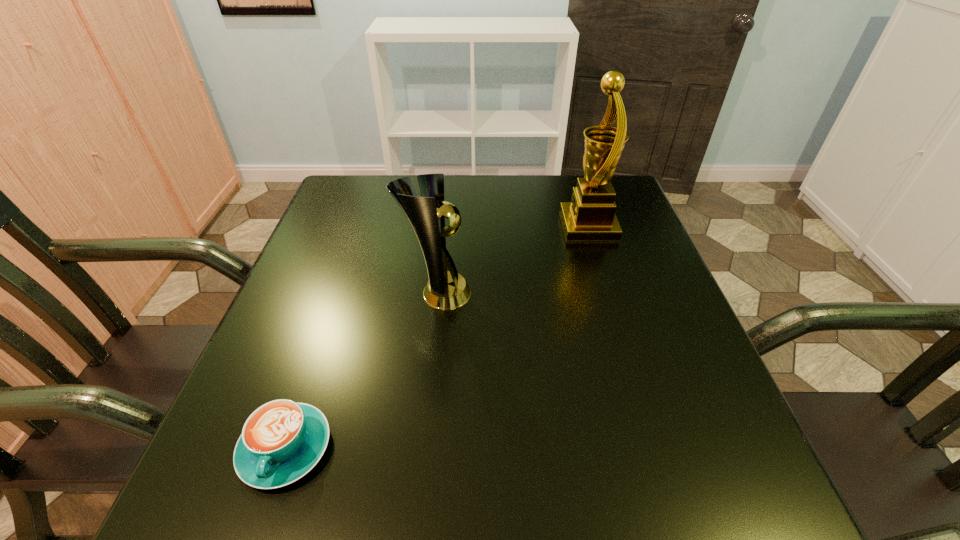
Identify the location of vacant region between the leftmost object and the taller award. (437, 337).

Locate an element on the screen. vacant point located between the tallest object and the cappuccino is located at coordinates (437, 337).

This screenshot has height=540, width=960. Find the location of `object that stands as the closest to the left award`. object that stands as the closest to the left award is located at coordinates [x=281, y=441].

Point out which object is positioned as the second nearest to the leftmost object. Please provide its 2D coordinates. Your answer should be formatted as a tuple, i.e. [(x, y)], where the tuple contains the x and y coordinates of a point satisfying the conditions above.

[(590, 216)]

Where is `free space that satisfies the following two spatial constraints: 1. on the front-facing side of the rightmost object; 2. with the handle on the right side of the nearest object`? The image size is (960, 540). free space that satisfies the following two spatial constraints: 1. on the front-facing side of the rightmost object; 2. with the handle on the right side of the nearest object is located at coordinates (658, 448).

The image size is (960, 540). Identify the location of blank space that satisfies the following two spatial constraints: 1. on the front-facing side of the taller award; 2. with the handle on the right side of the nearest object. coord(658,448).

This screenshot has width=960, height=540. I want to click on vacant region that satisfies the following two spatial constraints: 1. at the front of the second tallest object, where the globe is visible; 2. with the handle on the right side of the nearest object, so (x=421, y=448).

Where is `vacant space that satisfies the following two spatial constraints: 1. at the front of the nearer award, where the globe is visible; 2. with the handle on the right side of the leftmost object`? The width and height of the screenshot is (960, 540). vacant space that satisfies the following two spatial constraints: 1. at the front of the nearer award, where the globe is visible; 2. with the handle on the right side of the leftmost object is located at coordinates (421, 448).

At what (x,y) coordinates should I click in order to perform the action: click on free spot that satisfies the following two spatial constraints: 1. on the front-facing side of the taller award; 2. with the handle on the right side of the shortest object. Please return your answer as a coordinate pair (x, y). The width and height of the screenshot is (960, 540). Looking at the image, I should click on (658, 448).

Where is `free location that satisfies the following two spatial constraints: 1. on the front-facing side of the right award; 2. with the handle on the right side of the leftmost object`? The width and height of the screenshot is (960, 540). free location that satisfies the following two spatial constraints: 1. on the front-facing side of the right award; 2. with the handle on the right side of the leftmost object is located at coordinates (658, 448).